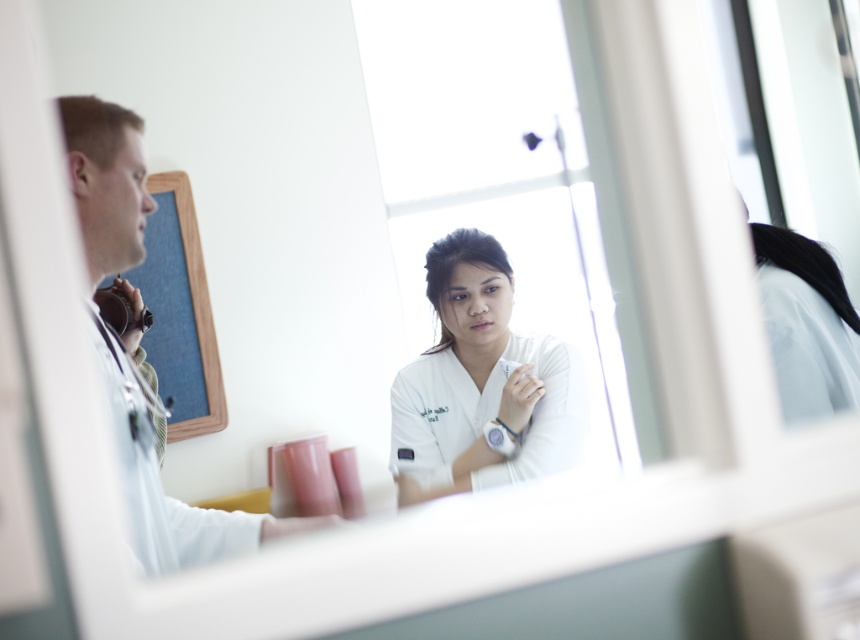
You are a healthcare worker entering a room and see the point marked at coordinates (481, 385). What is the object located at that point?

The point at (481, 385) marks the white smooth uniform at center.

You are a patient in a clinic and see the white smooth uniform at center and the white smooth stethoscope at left. Which object is taller?

The white smooth stethoscope at left is taller than the white smooth uniform at center.

You are a patient entering the room and see the white smooth uniform at center and the white smooth stethoscope at left. Which object is closer to the left side of the window?

The white smooth stethoscope at left is closer to the left side of the window because it is positioned to the left of the white smooth uniform at center.